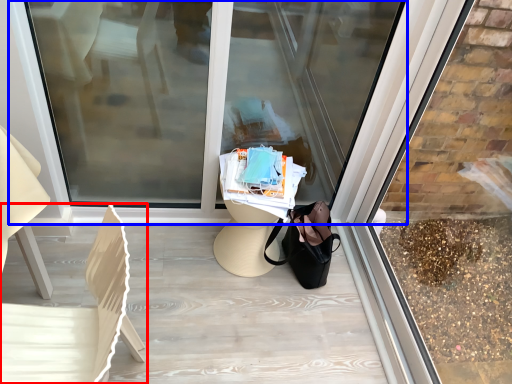
Question: Which object appears farthest to the camera in this image, chair (highlighted by a red box) or shop window (highlighted by a blue box)?

Choices:
 (A) chair
 (B) shop window

Answer: (B)